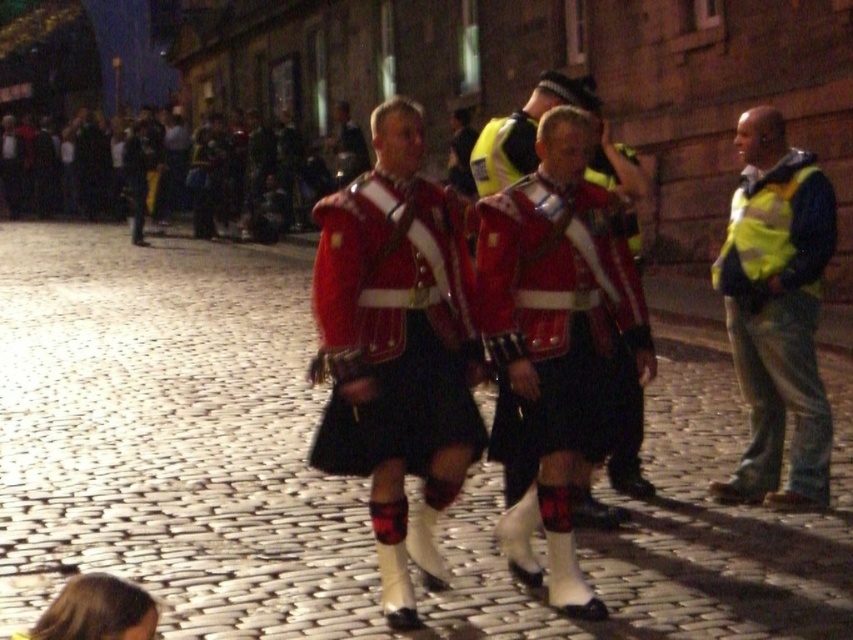
Who is lower down, yellow reflective vest at right or red velvet kilt at center?

red velvet kilt at center

Can you confirm if yellow reflective vest at right is shorter than red velvet kilt at center?

No.

What do you see at coordinates (776, 310) in the screenshot? This screenshot has width=853, height=640. I see `yellow reflective vest at right` at bounding box center [776, 310].

You are a GUI agent. You are given a task and a screenshot of the screen. Output one action in this format:
    pyautogui.click(x=<x>, y=<y>)
    Task: Click on the yellow reflective vest at right
    This screenshot has height=640, width=853.
    Given the screenshot: What is the action you would take?
    pyautogui.click(x=776, y=310)

Who is positioned more to the left, red woolen kilt at center or yellow reflective vest at right?

Positioned to the left is red woolen kilt at center.

Is point (395, 604) less distant than point (750, 282)?

Yes, it is in front of point (750, 282).

In order to click on red woolen kilt at center in this screenshot , I will do `click(396, 348)`.

This screenshot has height=640, width=853. Identify the location of red woolen kilt at center. (396, 348).

Can you confirm if red woolen kilt at center is positioned to the left of red velvet kilt at center?

Indeed, red woolen kilt at center is positioned on the left side of red velvet kilt at center.

Between red woolen kilt at center and red velvet kilt at center, which one appears on the right side from the viewer's perspective?

Positioned to the right is red velvet kilt at center.

Who is more forward, (321, 316) or (515, 339)?

Positioned in front is point (321, 316).

The image size is (853, 640). Identify the location of red woolen kilt at center. (396, 348).